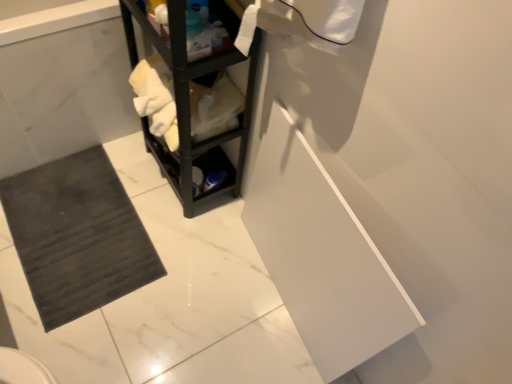
Find the location of `free space in front of dark gray rubber bath mat at lower left`. free space in front of dark gray rubber bath mat at lower left is located at coordinates (75, 218).